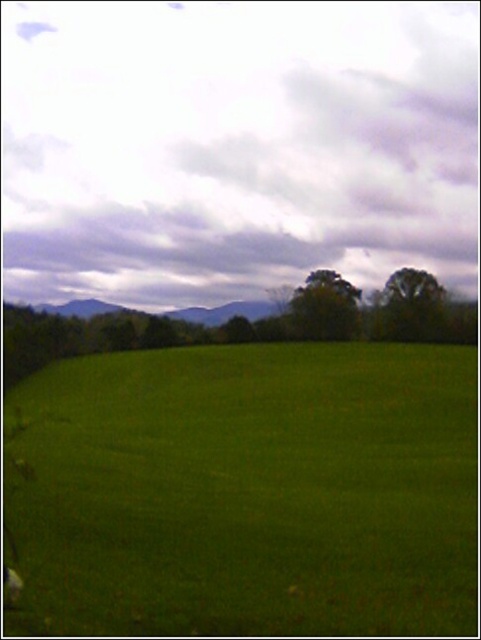
Question: Which is nearer to the green leafy tree at right?

Choices:
 (A) green leafy tree at center
 (B) green grassy pasture at center

Answer: (A)

Question: Is the position of green grassy pasture at center more distant than that of green leafy tree at center?

Choices:
 (A) yes
 (B) no

Answer: (B)

Question: Is green grassy pasture at center wider than green leafy tree at right?

Choices:
 (A) no
 (B) yes

Answer: (B)

Question: Which is farther from the green leafy tree at right?

Choices:
 (A) green grassy pasture at center
 (B) green leafy tree at center

Answer: (A)

Question: Is green grassy pasture at center below green leafy tree at center?

Choices:
 (A) yes
 (B) no

Answer: (A)

Question: Which of the following is the farthest from the observer?

Choices:
 (A) (431, 372)
 (B) (329, 336)

Answer: (B)